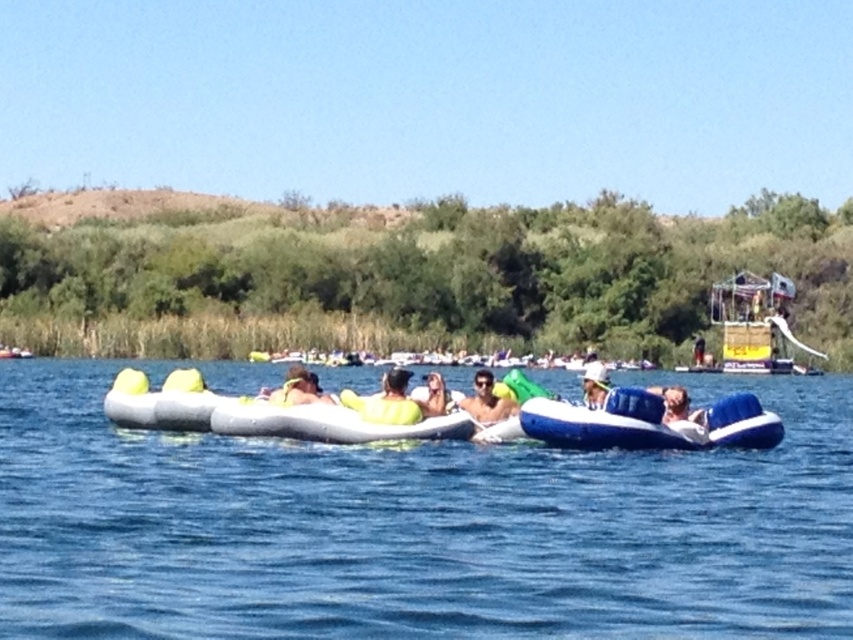
Question: Which is farther from the inflatable raft at center?

Choices:
 (A) yellow rubber ring at center
 (B) light blue fabric float at center
 (C) blue inflatable raft at center

Answer: (B)

Question: Can you confirm if matte yellow life vest at center is positioned to the right of white matte hat at center?

Choices:
 (A) yes
 (B) no

Answer: (B)

Question: Does inflatable white at center have a greater width compared to light blue fabric float at center?

Choices:
 (A) no
 (B) yes

Answer: (B)

Question: Is inflatable raft at center wider than white matte hat at center?

Choices:
 (A) yes
 (B) no

Answer: (A)

Question: Which object is farther from the camera taking this photo?

Choices:
 (A) blue inflatable raft at center
 (B) yellow rubber ring at center
 (C) inflatable white at center
 (D) white matte hat at center

Answer: (B)

Question: Which object is positioned farthest from the inflatable raft at center?

Choices:
 (A) light blue fabric float at center
 (B) matte yellow life vest at center
 (C) blue inflatable raft at center

Answer: (A)